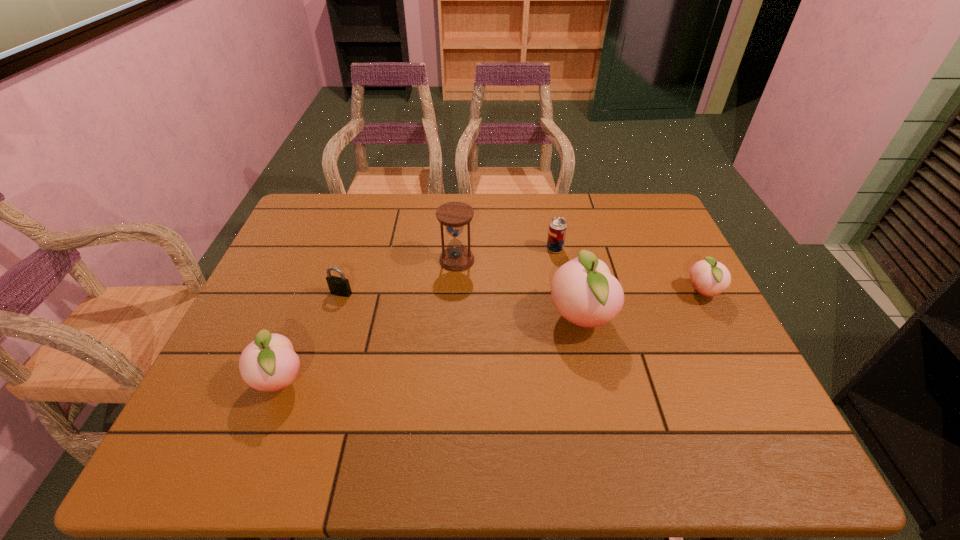
Where is `vacant space that satisfies the following two spatial constraints: 1. on the back side of the third tallest object; 2. on the right side of the beer can`? This screenshot has width=960, height=540. vacant space that satisfies the following two spatial constraints: 1. on the back side of the third tallest object; 2. on the right side of the beer can is located at coordinates (332, 249).

The width and height of the screenshot is (960, 540). What are the coordinates of `free spot that satisfies the following two spatial constraints: 1. on the back side of the shortest peach; 2. on the left side of the nearest object` in the screenshot? It's located at (315, 293).